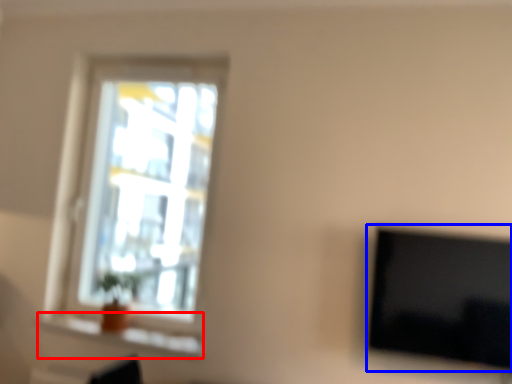
Question: Which object appears closest to the camera in this image, window sill (highlighted by a red box) or television (highlighted by a blue box)?

Choices:
 (A) window sill
 (B) television

Answer: (B)